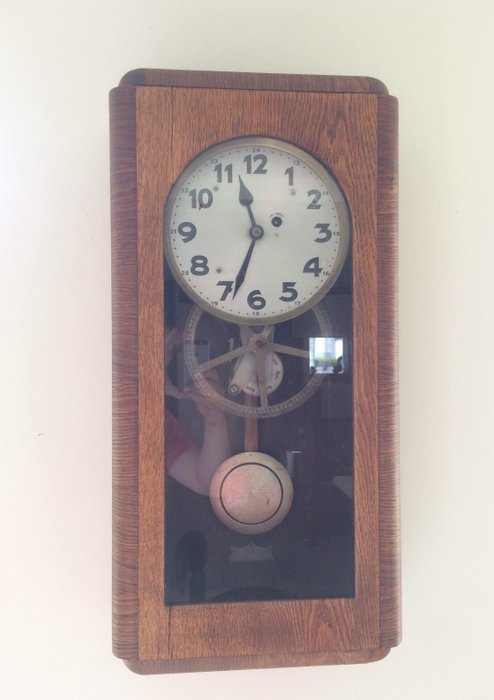
The height and width of the screenshot is (700, 494). Identify the location of white clock face. (272, 246).